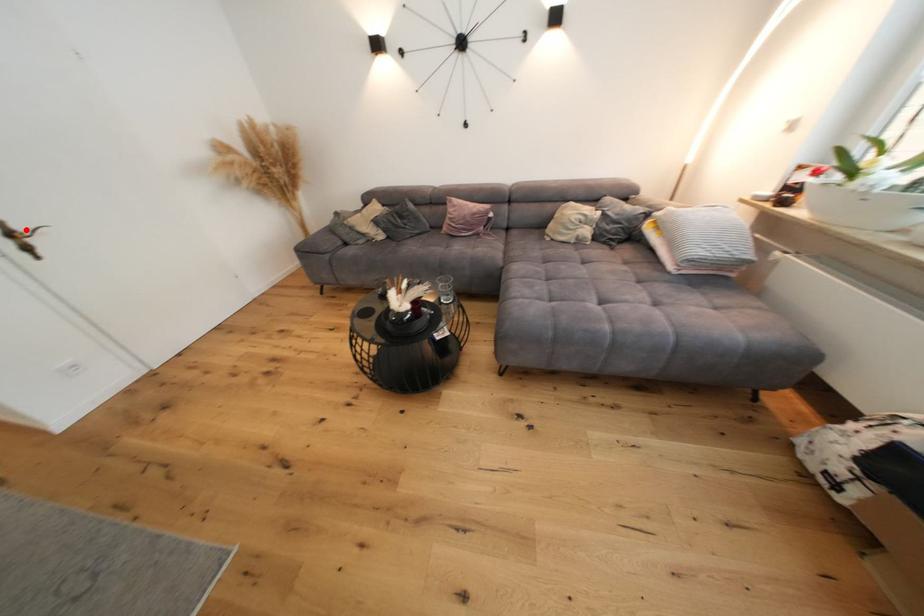
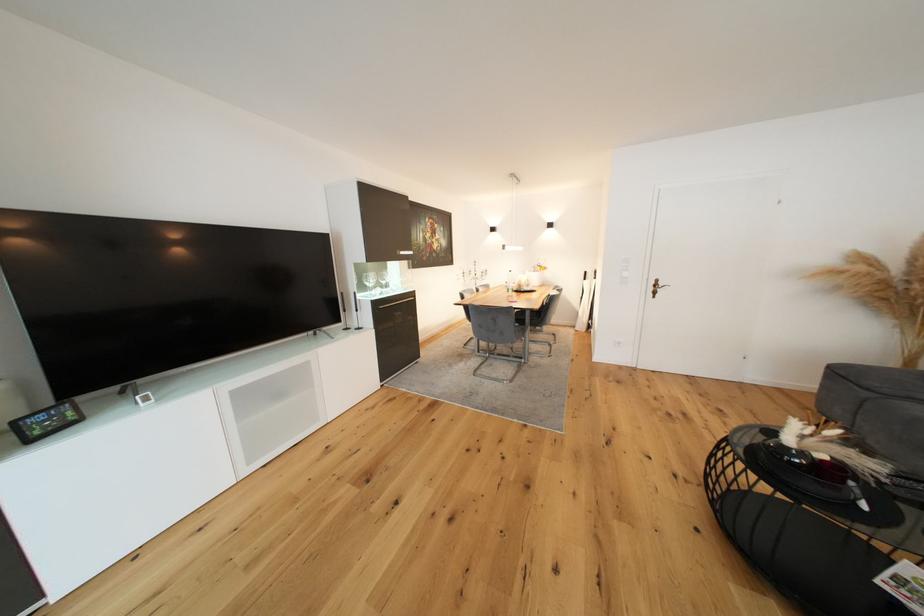
Question: I am providing you with two images of the same scene from different viewpoints. Image1 has a red point marked. In image2, the corresponding 3D location appears at what relative position? Reply with the corresponding letter.

Choices:
 (A) Closer
 (B) Farther

Answer: (A)